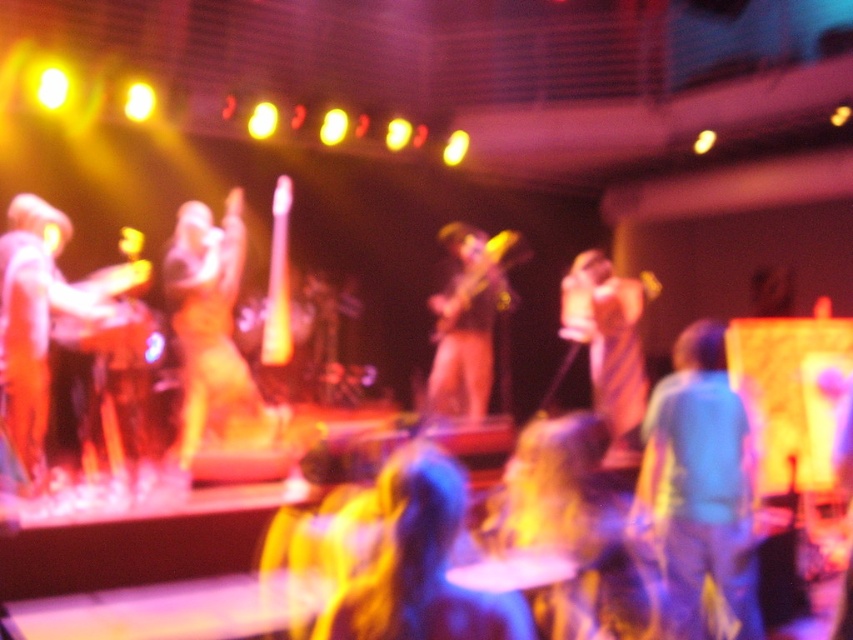
Based on the scene description, can you determine the spatial relationship between the shiny blue hair at center and the shiny gold dress at center?

The shiny blue hair at center is below the shiny gold dress at center.

You are a photographer at the back of the venue and want to capture a photo that includes both the shiny blue hair at center and the shiny gold dress at center. Given that your camera has a maximum focus range of 3 meters, can you ensure both subjects are in focus?

The shiny blue hair at center and shiny gold dress at center are 3.22 meters apart from each other. Since the distance between them exceeds the camera maximum focus range of 3 meters, the camera may not be able to keep both subjects in focus simultaneously.